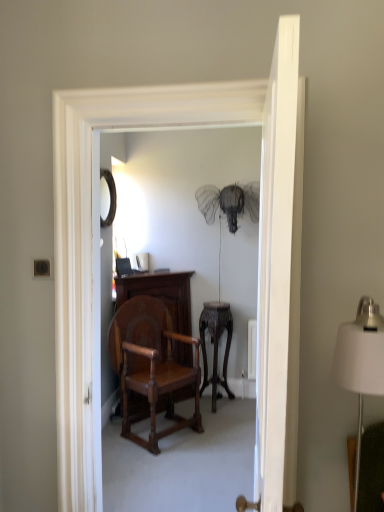
Identify the location of free region under dark wood side table at center (from a real-world perspective). (222, 402).